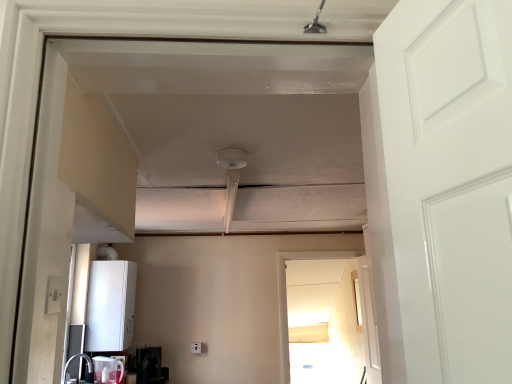
Locate an element on the screen. This screenshot has height=384, width=512. white plastic electric outlet at lower left is located at coordinates (54, 294).

In order to face white plastic electric outlet at lower left, should I rotate leftwards or rightwards?

A 25.277 degree turn to the left will do.

In order to click on matte white sink at lower left in this screenshot , I will do `click(73, 359)`.

This screenshot has height=384, width=512. Find the location of `white glossy jug at lower left, which appears as the second appliance when viewed from the top`. white glossy jug at lower left, which appears as the second appliance when viewed from the top is located at coordinates (106, 370).

In order to face white glossy door at right, should I rotate leftwards or rightwards?

You should rotate right by 15.271 degrees.

Describe the element at coordinates (148, 365) in the screenshot. I see `black glossy microwave at lower left, the 1th appliance positioned from the bottom` at that location.

At what (x,y) coordinates should I click in order to perform the action: click on white plastic electric outlet at lower left. Please return your answer as a coordinate pair (x, y). Looking at the image, I should click on (54, 294).

Between matte white sink at lower left and transparent glass screen door at center, which one is positioned behind?

transparent glass screen door at center is further away from the camera.

Can you confirm if matte white sink at lower left is bigger than transparent glass screen door at center?

Actually, matte white sink at lower left might be smaller than transparent glass screen door at center.

Does matte white sink at lower left appear on the right side of transparent glass screen door at center?

No, matte white sink at lower left is not to the right of transparent glass screen door at center.

From a real-world perspective, is matte white sink at lower left positioned above or below transparent glass screen door at center?

In terms of real-world spatial position, matte white sink at lower left is below transparent glass screen door at center.

Looking at this image, which object is closer to the camera taking this photo, matte white sink at lower left or white plastic electric outlet at lower left?

white plastic electric outlet at lower left is in front.

How much distance is there between matte white sink at lower left and white plastic electric outlet at lower left?

8.22 feet.

From the image's perspective, which is below, matte white sink at lower left or white plastic electric outlet at lower left?

matte white sink at lower left is shown below in the image.

Is there a large distance between matte white sink at lower left and white plastic electric outlet at lower left?

matte white sink at lower left is positioned a significant distance from white plastic electric outlet at lower left.

Who is smaller, white glossy door at right or white matte boiler at lower left, the 3th appliance when ordered from bottom to top?

white glossy door at right.

Image resolution: width=512 pixels, height=384 pixels. In order to click on the 1st appliance in front of the white glossy door at right in this screenshot , I will do `click(110, 306)`.

Is white matte boiler at lower left, which ranks as the 1th appliance in top-to-bottom order, inside white glossy door at right?

No, white matte boiler at lower left, which ranks as the 1th appliance in top-to-bottom order, is not surrounded by white glossy door at right.

From the image's perspective, is white glossy door at right above white matte boiler at lower left, which ranks as the 1th appliance in top-to-bottom order?

No, from the image's perspective, white glossy door at right is not on top of white matte boiler at lower left, which ranks as the 1th appliance in top-to-bottom order.

Find the location of a particular element. This screenshot has width=512, height=384. door on the right of white matte boiler at lower left, the 3th appliance when ordered from bottom to top is located at coordinates (368, 324).

From the picture: Which is more to the left, white matte boiler at lower left, which ranks as the 1th appliance in top-to-bottom order, or white glossy door at right?

white matte boiler at lower left, which ranks as the 1th appliance in top-to-bottom order, is more to the left.

Is white matte boiler at lower left, which ranks as the 1th appliance in top-to-bottom order, facing away from white glossy door at right?

No, white glossy door at right is not at the back of white matte boiler at lower left, which ranks as the 1th appliance in top-to-bottom order.

Which is nearer, (109,343) or (362,282)?

The point (109,343) is in front.

From a real-world perspective, relative to black glossy microwave at lower left, the third appliance in the top-to-bottom sequence, is white plastic electric outlet at lower left vertically above or below?

white plastic electric outlet at lower left is above black glossy microwave at lower left, the third appliance in the top-to-bottom sequence.

From the picture: Is white plastic electric outlet at lower left oriented towards black glossy microwave at lower left, the 1th appliance positioned from the bottom?

No, white plastic electric outlet at lower left is not aimed at black glossy microwave at lower left, the 1th appliance positioned from the bottom.

Is white plastic electric outlet at lower left placed right next to black glossy microwave at lower left, the third appliance in the top-to-bottom sequence?

white plastic electric outlet at lower left is not next to black glossy microwave at lower left, the third appliance in the top-to-bottom sequence, and they're not touching.

Considering the positions of points (59, 287) and (149, 360), is point (59, 287) farther from camera compared to point (149, 360)?

No.

Can you confirm if white matte boiler at lower left, which ranks as the 1th appliance in top-to-bottom order, is positioned to the left of white glossy jug at lower left, which appears as the second appliance when viewed from the top?

Yes.

From a real-world perspective, does white matte boiler at lower left, which ranks as the 1th appliance in top-to-bottom order, sit lower than white glossy jug at lower left, which appears as the second appliance when viewed from the top?

Actually, white matte boiler at lower left, which ranks as the 1th appliance in top-to-bottom order, is physically above white glossy jug at lower left, which appears as the second appliance when viewed from the top, in the real world.

Do you think white matte boiler at lower left, the 3th appliance when ordered from bottom to top, is within white glossy jug at lower left, the second appliance when ordered from bottom to top, or outside of it?

The correct answer is: outside.

Is white matte boiler at lower left, which ranks as the 1th appliance in top-to-bottom order, directly adjacent to white glossy jug at lower left, which appears as the second appliance when viewed from the top?

white matte boiler at lower left, which ranks as the 1th appliance in top-to-bottom order, is not next to white glossy jug at lower left, which appears as the second appliance when viewed from the top, and they're not touching.

Would you say transparent glass screen door at center is a long distance from white matte boiler at lower left, which ranks as the 1th appliance in top-to-bottom order?

Yes, transparent glass screen door at center and white matte boiler at lower left, which ranks as the 1th appliance in top-to-bottom order, are quite far apart.

Is white matte boiler at lower left, which ranks as the 1th appliance in top-to-bottom order, at the back of transparent glass screen door at center?

No, transparent glass screen door at center's orientation is not away from white matte boiler at lower left, which ranks as the 1th appliance in top-to-bottom order.

From the image's perspective, who appears lower, transparent glass screen door at center or white matte boiler at lower left, which ranks as the 1th appliance in top-to-bottom order?

From the image's view, transparent glass screen door at center is below.

From a real-world perspective, is transparent glass screen door at center above or below white matte boiler at lower left, which ranks as the 1th appliance in top-to-bottom order?

From a real-world perspective, transparent glass screen door at center is physically below white matte boiler at lower left, which ranks as the 1th appliance in top-to-bottom order.

In order to click on screen door below the matte white sink at lower left (from the image's perspective) in this screenshot , I will do `click(321, 322)`.

Identify the location of electric outlet above the matte white sink at lower left (from the image's perspective). tap(54, 294).

Considering their positions, is black glossy microwave at lower left, the third appliance in the top-to-bottom sequence, positioned further to transparent glass screen door at center than matte white sink at lower left?

matte white sink at lower left is further to transparent glass screen door at center.

Estimate the real-world distances between objects in this image. Which object is closer to white plastic electric outlet at lower left, white glossy door at right or white matte boiler at lower left, the 3th appliance when ordered from bottom to top?

Among the two, white matte boiler at lower left, the 3th appliance when ordered from bottom to top, is located nearer to white plastic electric outlet at lower left.

Based on their spatial positions, is white matte boiler at lower left, the 3th appliance when ordered from bottom to top, or matte white sink at lower left further from white glossy jug at lower left, which appears as the second appliance when viewed from the top?

white matte boiler at lower left, the 3th appliance when ordered from bottom to top.

Considering their positions, is black glossy microwave at lower left, the 1th appliance positioned from the bottom, positioned further to white glossy jug at lower left, the second appliance when ordered from bottom to top, than white glossy door at right?

white glossy door at right.

In the scene shown: Looking at the image, which one is located closer to black glossy microwave at lower left, the 1th appliance positioned from the bottom, white glossy door at right or matte white sink at lower left?

Among the two, matte white sink at lower left is located nearer to black glossy microwave at lower left, the 1th appliance positioned from the bottom.

Considering their positions, is white glossy door at right positioned further to white glossy jug at lower left, the second appliance when ordered from bottom to top, than white matte boiler at lower left, the 3th appliance when ordered from bottom to top?

white glossy door at right.

Looking at the image, which one is located further to white glossy door at right, white glossy jug at lower left, the second appliance when ordered from bottom to top, or matte white sink at lower left?

Among the two, matte white sink at lower left is located further to white glossy door at right.

Which object lies further to the anchor point white plastic electric outlet at lower left, transparent glass screen door at center or white matte boiler at lower left, the 3th appliance when ordered from bottom to top?

transparent glass screen door at center.

Where is `sink positioned between white plastic electric outlet at lower left and black glossy microwave at lower left, the 1th appliance positioned from the bottom, from near to far`? sink positioned between white plastic electric outlet at lower left and black glossy microwave at lower left, the 1th appliance positioned from the bottom, from near to far is located at coordinates (73, 359).

Where is `appliance located between white plastic electric outlet at lower left and white matte boiler at lower left, which ranks as the 1th appliance in top-to-bottom order, in the depth direction`? This screenshot has width=512, height=384. appliance located between white plastic electric outlet at lower left and white matte boiler at lower left, which ranks as the 1th appliance in top-to-bottom order, in the depth direction is located at coordinates (106, 370).

Locate an element on the screen. The image size is (512, 384). appliance between white glossy jug at lower left, the second appliance when ordered from bottom to top, and transparent glass screen door at center from left to right is located at coordinates (148, 365).

Identify the location of sink located between white matte boiler at lower left, the 3th appliance when ordered from bottom to top, and transparent glass screen door at center in the left-right direction. (73, 359).